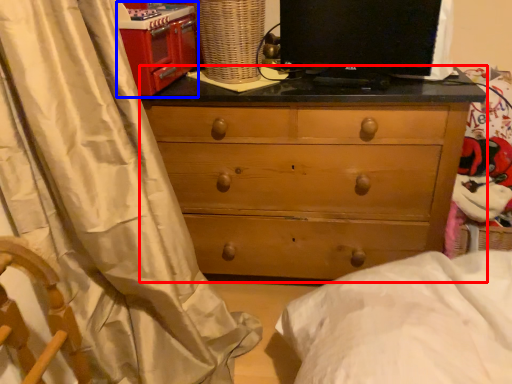
Question: Which object is further to the camera taking this photo, chest of drawers (highlighted by a red box) or appliance (highlighted by a blue box)?

Choices:
 (A) chest of drawers
 (B) appliance

Answer: (A)